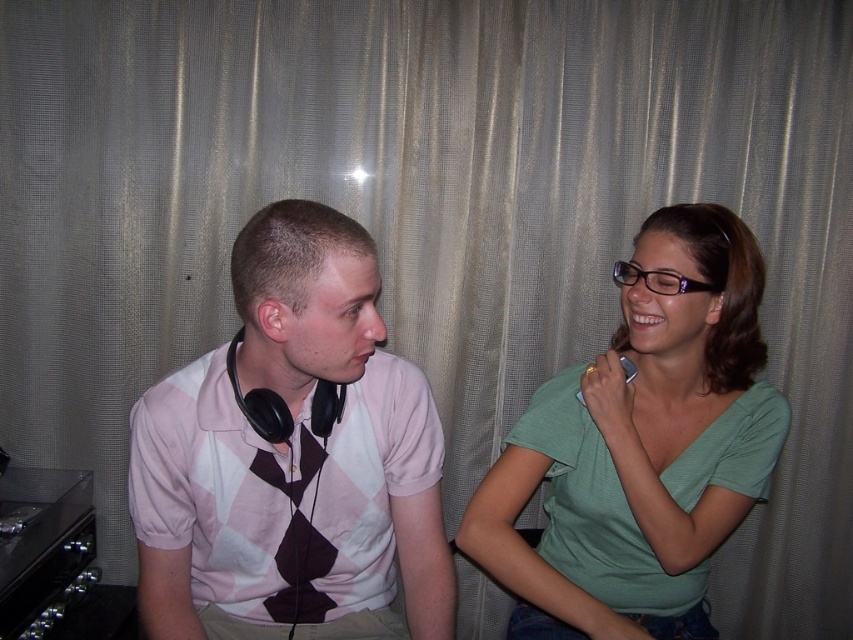
From the picture: You are a photographer setting up for a photoshoot. You need to position a spotlight so that it illuminates the pink argyle shirt at center and the green matte shirt at right without casting shadows on the curtain. Given their positions, which shirt should you focus the spotlight on first to avoid shadows?

The pink argyle shirt at center is in front of the green matte shirt at right, so you should focus the spotlight on the pink argyle shirt at center first to prevent its shadow from falling on the curtain.

You are a photographer setting up for a shoot. You need to position a spotlight to the right of both the pink argyle shirt at center and the green matte shirt at right. Is this possible given their positions?

The pink argyle shirt at center is to the left of the green matte shirt at right. Since the spotlight needs to be to the right of both, it would have to be placed further to the right of the green matte shirt at right. This is possible as there is space beyond the green matte shirt at right.

You are a photographer standing 2 feet away from the pink argyle shirt at center and the green matte shirt at right. You want to take a photo that includes both shirts in the frame. Based on their distance apart, will you need to zoom in or zoom out to ensure both shirts are fully visible?

The pink argyle shirt at center is 15.07 inches from the green matte shirt at right. To include both shirts in the frame, you would need to zoom out to capture the distance between them.